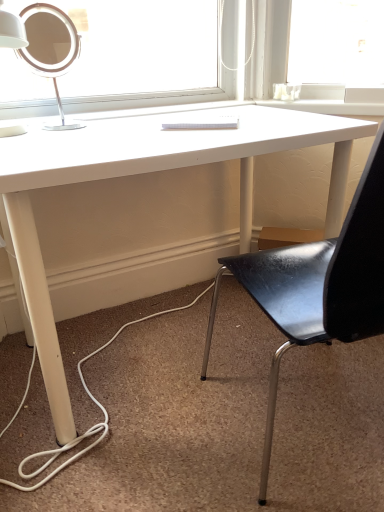
Identify the location of vacant space underneath white matte desk at center (from a real-world perspective). (168, 343).